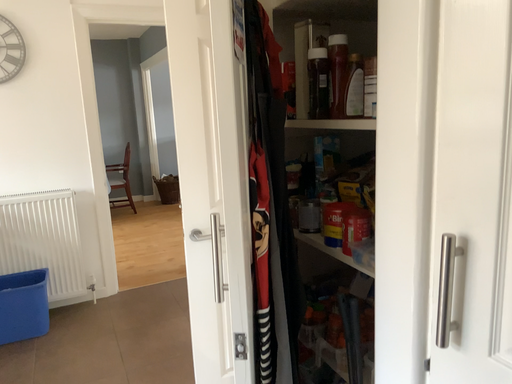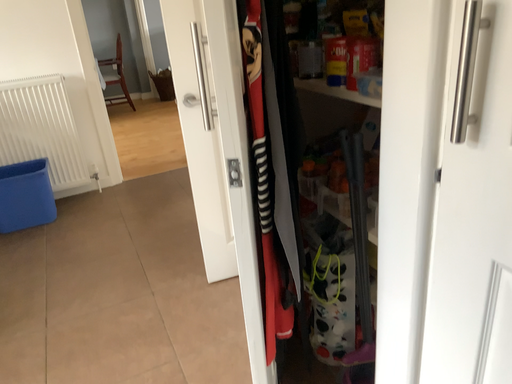
Question: Which way did the camera rotate in the video?

Choices:
 (A) rotated upward
 (B) rotated downward

Answer: (B)